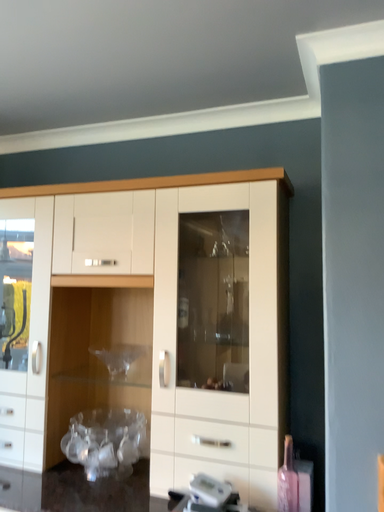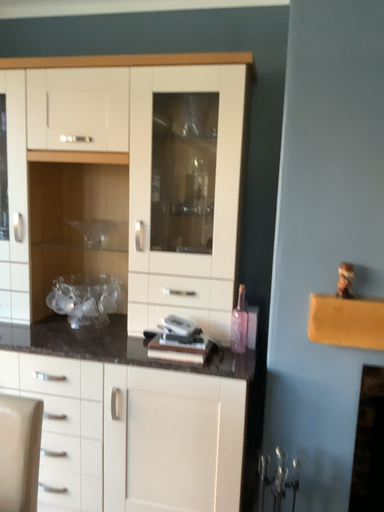
Question: Which way did the camera rotate in the video?

Choices:
 (A) rotated left
 (B) rotated right

Answer: (B)